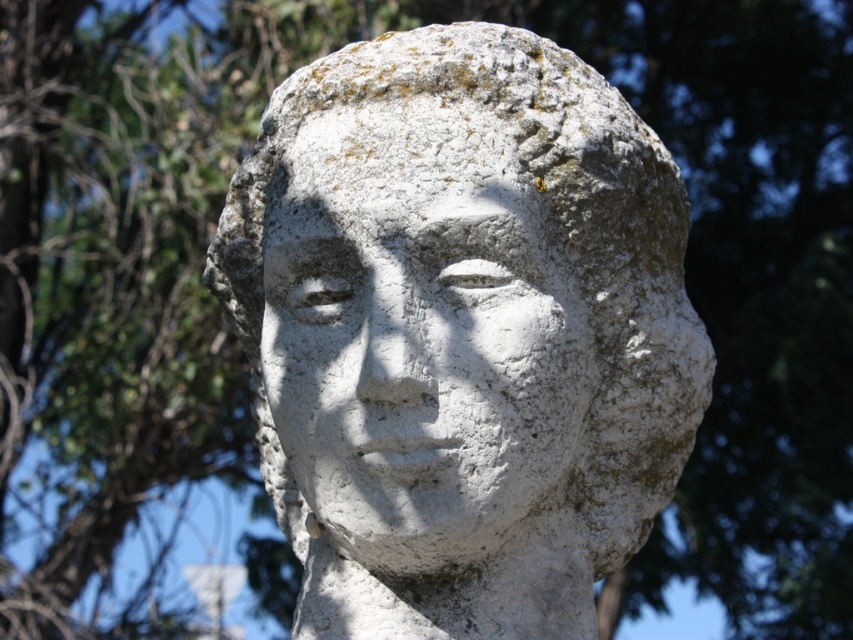
Question: Which point is farther from the camera taking this photo?

Choices:
 (A) (271, 262)
 (B) (550, 340)

Answer: (A)

Question: Is white stone bust at center thinner than white stone face at center?

Choices:
 (A) yes
 (B) no

Answer: (B)

Question: Can you confirm if white stone bust at center is wider than white stone face at center?

Choices:
 (A) yes
 (B) no

Answer: (A)

Question: Which of the following is the farthest from the observer?

Choices:
 (A) (431, 435)
 (B) (363, 246)

Answer: (B)

Question: Does white stone bust at center have a larger size compared to white stone face at center?

Choices:
 (A) no
 (B) yes

Answer: (B)